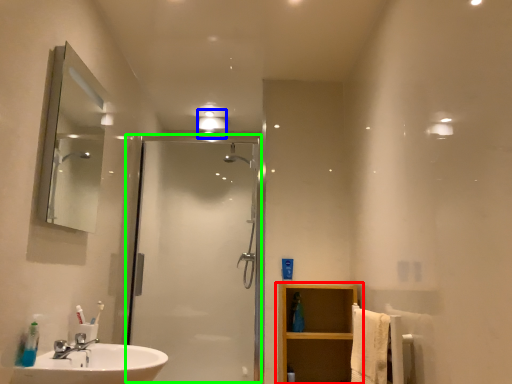
Question: Based on their relative distances, which object is nearer to bathroom cabinet (highlighted by a red box)? Choose from light fixture (highlighted by a blue box) and screen door (highlighted by a green box).

Choices:
 (A) light fixture
 (B) screen door

Answer: (B)